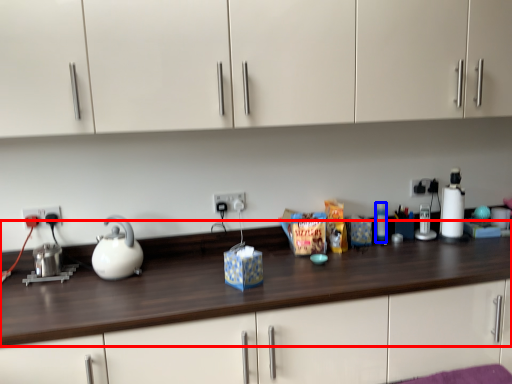
Question: Which of the following is the closest to the observer, counter top (highlighted by a red box) or bottle (highlighted by a blue box)?

Choices:
 (A) counter top
 (B) bottle

Answer: (A)